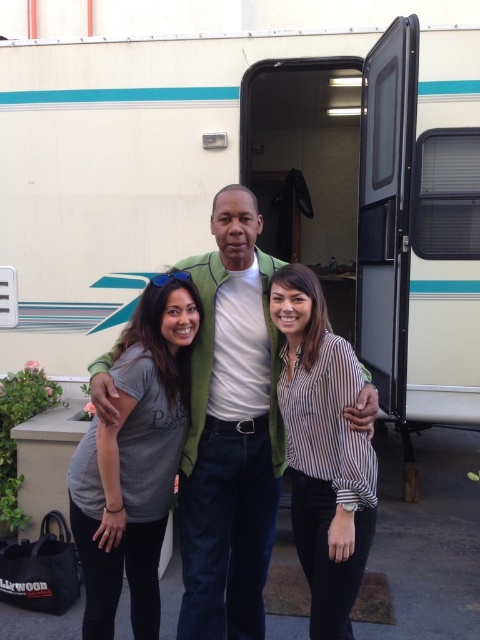
Who is taller, green matte jacket at center or striped fabric shirt at center?

green matte jacket at center

Between green matte jacket at center and striped fabric shirt at center, which one appears on the left side from the viewer's perspective?

Positioned to the left is green matte jacket at center.

Is point (214, 256) positioned before point (307, 317)?

No, it is behind (307, 317).

Locate an element on the screen. green matte jacket at center is located at coordinates (230, 432).

In the scene shown: Can you confirm if green matte jacket at center is thinner than gray cotton t-shirt at center?

Indeed, green matte jacket at center has a lesser width compared to gray cotton t-shirt at center.

Is point (204, 384) in front of point (165, 320)?

No.

Locate an element on the screen. The image size is (480, 640). green matte jacket at center is located at coordinates (230, 432).

Does gray cotton t-shirt at center have a greater width compared to striped fabric shirt at center?

Indeed, gray cotton t-shirt at center has a greater width compared to striped fabric shirt at center.

Can you confirm if gray cotton t-shirt at center is shorter than striped fabric shirt at center?

No, gray cotton t-shirt at center is not shorter than striped fabric shirt at center.

This screenshot has width=480, height=640. What are the coordinates of `gray cotton t-shirt at center` in the screenshot? It's located at (134, 458).